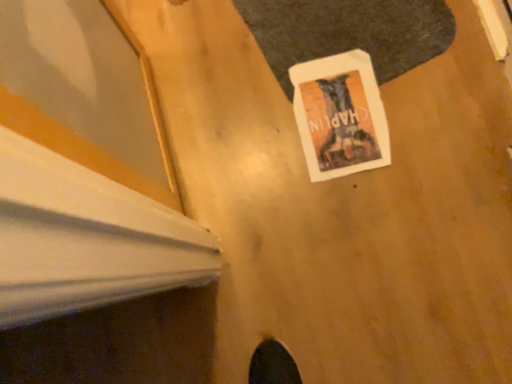
The width and height of the screenshot is (512, 384). Identify the location of vacant space to the left of white paper at center. (257, 145).